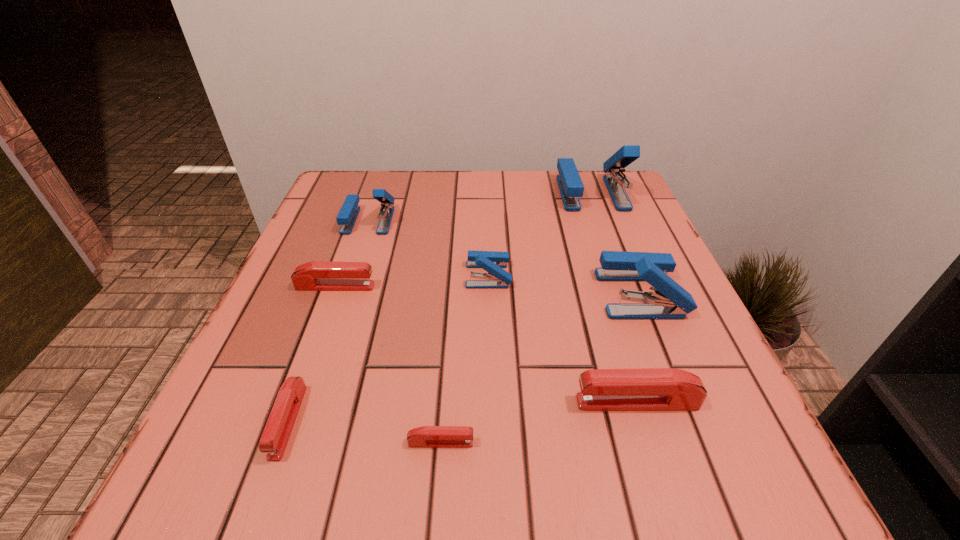
Image resolution: width=960 pixels, height=540 pixels. Find the location of `the biggest blue stapler`. the biggest blue stapler is located at coordinates (571, 187).

Find the location of a particular element. the tallest object is located at coordinates (571, 187).

This screenshot has height=540, width=960. I want to click on the seventh shortest stapler, so click(670, 301).

Locate an element on the screen. The image size is (960, 540). the second tallest object is located at coordinates (670, 301).

Find the location of a particular element. the sixth shortest stapler is located at coordinates (347, 216).

At what (x,y) coordinates should I click in order to perform the action: click on the sixth shortest object. Please return your answer as a coordinate pair (x, y). The width and height of the screenshot is (960, 540). Looking at the image, I should click on (347, 216).

Where is `the smallest blue stapler`? the smallest blue stapler is located at coordinates (492, 262).

Locate an element on the screen. The height and width of the screenshot is (540, 960). the biggest red stapler is located at coordinates tap(650, 389).

Where is `the third shortest object`? The image size is (960, 540). the third shortest object is located at coordinates (317, 275).

Locate an element on the screen. The width and height of the screenshot is (960, 540). the third smallest red stapler is located at coordinates (317, 275).